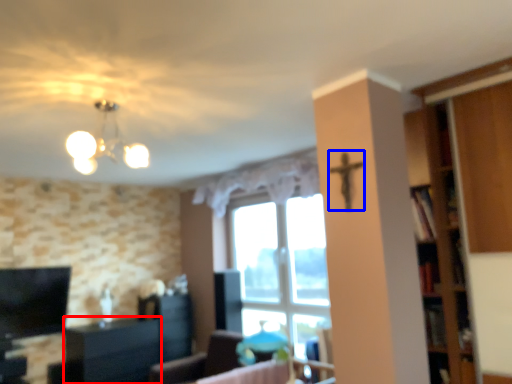
Question: Which object is further to the camera taking this photo, cabinetry (highlighted by a red box) or crucifix (highlighted by a blue box)?

Choices:
 (A) cabinetry
 (B) crucifix

Answer: (A)